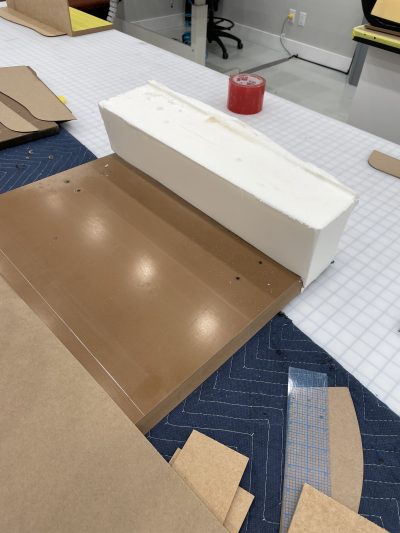
You are a GUI agent. You are given a task and a screenshot of the screen. Output one action in this format:
    pyautogui.click(x=<x>, y=<y>)
    Task: Click on the wall
    
    Given the screenshot: What is the action you would take?
    pyautogui.click(x=327, y=23)